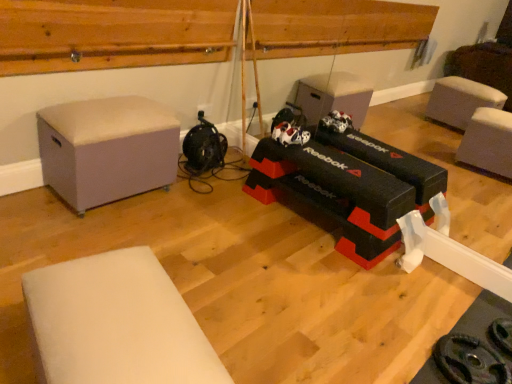
Question: Would you say white foam mat at lower left, positioned as the 2th furniture in back-to-front order, is part of wooden at upper center's contents?

Choices:
 (A) no
 (B) yes

Answer: (A)

Question: Considering the relative sizes of wooden at upper center and white foam mat at lower left, the first furniture positioned from the bottom, in the image provided, is wooden at upper center thinner than white foam mat at lower left, the first furniture positioned from the bottom,?

Choices:
 (A) yes
 (B) no

Answer: (A)

Question: Is wooden at upper center not near white foam mat at lower left, positioned as the 2th furniture in back-to-front order?

Choices:
 (A) yes
 (B) no

Answer: (A)

Question: Is wooden at upper center shorter than white foam mat at lower left, arranged as the second furniture when viewed from the top?

Choices:
 (A) no
 (B) yes

Answer: (B)

Question: Considering the relative positions of wooden at upper center and white foam mat at lower left, arranged as the second furniture when viewed from the top, in the image provided, is wooden at upper center to the left of white foam mat at lower left, arranged as the second furniture when viewed from the top, from the viewer's perspective?

Choices:
 (A) no
 (B) yes

Answer: (B)

Question: From a real-world perspective, relative to white foam mat at lower left, which is the 1th furniture in front-to-back order, is wooden at upper center vertically above or below?

Choices:
 (A) above
 (B) below

Answer: (A)

Question: From the image's perspective, relative to white foam mat at lower left, arranged as the second furniture when viewed from the top, is wooden at upper center above or below?

Choices:
 (A) above
 (B) below

Answer: (A)

Question: Considering the relative positions of wooden at upper center and white foam mat at lower left, which is the 1th furniture in front-to-back order, in the image provided, is wooden at upper center to the left or to the right of white foam mat at lower left, which is the 1th furniture in front-to-back order,?

Choices:
 (A) right
 (B) left

Answer: (B)

Question: Looking at their shapes, would you say wooden at upper center is wider or thinner than white foam mat at lower left, which is the 1th furniture in front-to-back order?

Choices:
 (A) thin
 (B) wide

Answer: (A)

Question: From their relative heights in the image, would you say wooden at upper center is taller or shorter than light gray fabric ottoman at left, acting as the 2th furniture starting from the front?

Choices:
 (A) short
 (B) tall

Answer: (A)

Question: From the image's perspective, is wooden at upper center positioned above or below light gray fabric ottoman at left, acting as the 2th furniture starting from the front?

Choices:
 (A) below
 (B) above

Answer: (B)

Question: Is point (0, 19) closer or farther from the camera than point (57, 172)?

Choices:
 (A) farther
 (B) closer

Answer: (B)

Question: From a real-world perspective, is wooden at upper center positioned above or below light gray fabric ottoman at left, the 1th furniture positioned from the back?

Choices:
 (A) above
 (B) below

Answer: (A)

Question: Choose the correct answer: Is light gray fabric ottoman at left, acting as the 2th furniture starting from the front, inside wooden at upper center or outside it?

Choices:
 (A) outside
 (B) inside

Answer: (A)

Question: Is light gray fabric ottoman at left, acting as the 2th furniture starting from the front, in front of or behind wooden at upper center in the image?

Choices:
 (A) behind
 (B) front

Answer: (A)